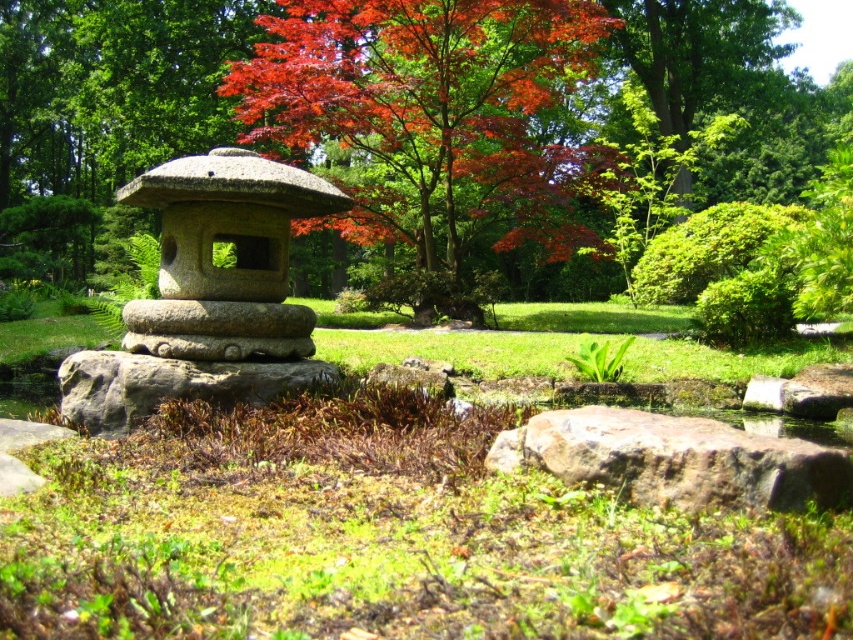
You are a gardener planning to plant a new flower bed between the red leafy maple at center and the brown rough rock at center. Which object should you consider in terms of height when deciding where to place the flowers?

The red leafy maple at center is taller than the brown rough rock at center, so you should consider the height of the red leafy maple at center to ensure the flower bed is appropriately placed beneath it.